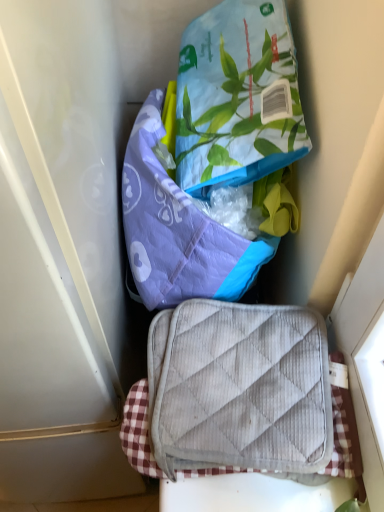
Question: Is printed fabric pouch at upper center, which appears as the second pouch when ordered from the bottom, oriented away from purple quilted pouch at center, placed as the second pouch when sorted from top to bottom?

Choices:
 (A) yes
 (B) no

Answer: (B)

Question: Does printed fabric pouch at upper center, which appears as the second pouch when ordered from the bottom, have a greater width compared to purple quilted pouch at center, placed as the first pouch when sorted from bottom to top?

Choices:
 (A) yes
 (B) no

Answer: (A)

Question: Is printed fabric pouch at upper center, the 1th pouch in the top-to-bottom sequence, at the right side of purple quilted pouch at center, placed as the second pouch when sorted from top to bottom?

Choices:
 (A) yes
 (B) no

Answer: (A)

Question: From the image's perspective, is printed fabric pouch at upper center, the 1th pouch in the top-to-bottom sequence, beneath purple quilted pouch at center, placed as the first pouch when sorted from bottom to top?

Choices:
 (A) no
 (B) yes

Answer: (A)

Question: Is printed fabric pouch at upper center, the 1th pouch in the top-to-bottom sequence, bigger than purple quilted pouch at center, placed as the second pouch when sorted from top to bottom?

Choices:
 (A) no
 (B) yes

Answer: (A)

Question: Is point [238, 399] positioned closer to the camera than point [173, 238]?

Choices:
 (A) farther
 (B) closer

Answer: (B)

Question: In the image, is gray quilted suitcase at center positioned in front of or behind purple quilted pouch at center, placed as the second pouch when sorted from top to bottom?

Choices:
 (A) behind
 (B) front

Answer: (B)

Question: From a real-world perspective, is gray quilted suitcase at center above or below purple quilted pouch at center, placed as the second pouch when sorted from top to bottom?

Choices:
 (A) above
 (B) below

Answer: (B)

Question: From the image's perspective, is gray quilted suitcase at center positioned above or below purple quilted pouch at center, placed as the second pouch when sorted from top to bottom?

Choices:
 (A) above
 (B) below

Answer: (B)

Question: From a real-world perspective, is gray quilted suitcase at center positioned above or below printed fabric pouch at upper center, the 1th pouch in the top-to-bottom sequence?

Choices:
 (A) below
 (B) above

Answer: (A)

Question: Based on their positions, is gray quilted suitcase at center located to the left or right of printed fabric pouch at upper center, which appears as the second pouch when ordered from the bottom?

Choices:
 (A) left
 (B) right

Answer: (B)

Question: Is gray quilted suitcase at center bigger or smaller than printed fabric pouch at upper center, the 1th pouch in the top-to-bottom sequence?

Choices:
 (A) big
 (B) small

Answer: (B)

Question: Would you say gray quilted suitcase at center is inside or outside printed fabric pouch at upper center, which appears as the second pouch when ordered from the bottom?

Choices:
 (A) inside
 (B) outside

Answer: (B)

Question: Is purple quilted pouch at center, placed as the second pouch when sorted from top to bottom, bigger or smaller than printed fabric pouch at upper center, which appears as the second pouch when ordered from the bottom?

Choices:
 (A) big
 (B) small

Answer: (A)

Question: Does point (256, 250) appear closer or farther from the camera than point (213, 131)?

Choices:
 (A) closer
 (B) farther

Answer: (A)